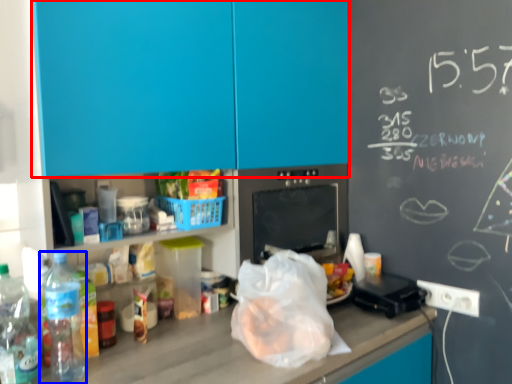
Question: Which object appears farthest to the camera in this image, cabinetry (highlighted by a red box) or bottle (highlighted by a blue box)?

Choices:
 (A) cabinetry
 (B) bottle

Answer: (B)